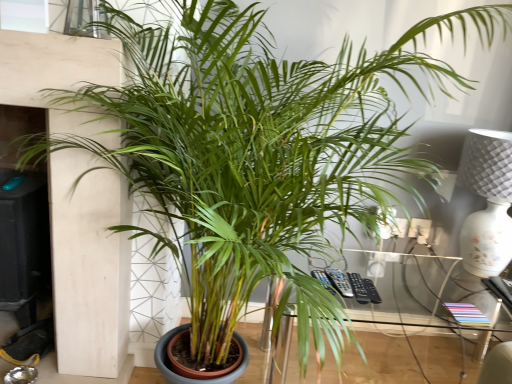
Find the location of `white textured lamp at right`. white textured lamp at right is located at coordinates (487, 201).

Which is correct: white textured lamp at right is inside clear glass window at upper center, or outside of it?

white textured lamp at right exists outside the volume of clear glass window at upper center.

Is white textured lamp at right touching clear glass window at upper center?

white textured lamp at right is not next to clear glass window at upper center, and they're not touching.

From a real-world perspective, is white textured lamp at right positioned above or below clear glass window at upper center?

In terms of real-world spatial position, white textured lamp at right is below clear glass window at upper center.

This screenshot has height=384, width=512. What are the coordinates of `table lamp on the right side of clear glass window at upper center` in the screenshot? It's located at (487, 201).

From the picture: Which is more to the left, clear glass window at upper center or transparent glass table at center?

clear glass window at upper center is more to the left.

Based on the photo, what's the angular difference between clear glass window at upper center and transparent glass table at center's facing directions?

clear glass window at upper center and transparent glass table at center are facing 7.38 degrees away from each other.

From a real-world perspective, is clear glass window at upper center under transparent glass table at center?

No.

Considering the sizes of objects clear glass window at upper center and white textured lamp at right in the image provided, who is bigger, clear glass window at upper center or white textured lamp at right?

white textured lamp at right is bigger.

From a real-world perspective, who is located higher, clear glass window at upper center or white textured lamp at right?

From a 3D spatial view, clear glass window at upper center is above.

From the image's perspective, is clear glass window at upper center positioned above or below white textured lamp at right?

clear glass window at upper center is situated higher than white textured lamp at right in the image.

Does point (75, 10) lie in front of point (496, 229)?

Yes, it is.

Does point (362, 320) appear closer or farther from the camera than point (72, 23)?

Point (362, 320) is farther from the camera than point (72, 23).

In order to click on table below the clear glass window at upper center (from a real-world perspective) in this screenshot , I will do `click(434, 310)`.

Which object is more forward, transparent glass table at center or clear glass window at upper center?

clear glass window at upper center is in front.

Can you confirm if white textured lamp at right is bigger than transparent glass table at center?

No.

Which is behind, point (477, 181) or point (489, 329)?

The point (477, 181) is farther from the camera.

Between white textured lamp at right and transparent glass table at center, which one has smaller width?

Thinner between the two is white textured lamp at right.

From a real-world perspective, is white textured lamp at right physically above transparent glass table at center?

Yes, from a real-world perspective, white textured lamp at right is above transparent glass table at center.

Looking at their sizes, would you say transparent glass table at center is wider or thinner than white textured lamp at right?

Considering their sizes, transparent glass table at center looks broader than white textured lamp at right.

Consider the image. Considering the relative positions of transparent glass table at center and white textured lamp at right in the image provided, is transparent glass table at center in front of white textured lamp at right?

Yes.

Is transparent glass table at center shorter than white textured lamp at right?

Indeed, transparent glass table at center has a lesser height compared to white textured lamp at right.

Identify the location of table lamp located underneath the clear glass window at upper center (from a real-world perspective). [x=487, y=201].

Find the location of a particular element. Image resolution: width=512 pixels, height=384 pixels. table behind the clear glass window at upper center is located at coordinates (434, 310).

When comparing their distances from clear glass window at upper center, does transparent glass table at center or white textured lamp at right seem closer?

The object closer to clear glass window at upper center is white textured lamp at right.

Looking at the image, which one is located closer to transparent glass table at center, white textured lamp at right or clear glass window at upper center?

white textured lamp at right is closer to transparent glass table at center.

Looking at this image, from the image, which object appears to be farther from white textured lamp at right, transparent glass table at center or clear glass window at upper center?

clear glass window at upper center lies further to white textured lamp at right than the other object.

Which object lies nearer to the anchor point white textured lamp at right, clear glass window at upper center or transparent glass table at center?

transparent glass table at center lies closer to white textured lamp at right than the other object.

When comparing their distances from transparent glass table at center, does clear glass window at upper center or white textured lamp at right seem further?

clear glass window at upper center is further to transparent glass table at center.

Estimate the real-world distances between objects in this image. Which object is further from clear glass window at upper center, white textured lamp at right or transparent glass table at center?

Among the two, transparent glass table at center is located further to clear glass window at upper center.

The height and width of the screenshot is (384, 512). I want to click on table between clear glass window at upper center and white textured lamp at right, so click(x=434, y=310).